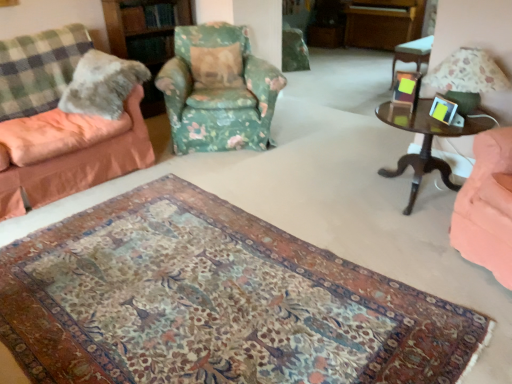
Question: Is metallic silver picture frame at upper right, which appears as the second picture frame when viewed from the front, spatially inside green checkered blanket at left, or outside of it?

Choices:
 (A) inside
 (B) outside

Answer: (B)

Question: Relative to green checkered blanket at left, is metallic silver picture frame at upper right, which appears as the second picture frame when viewed from the front, in front or behind?

Choices:
 (A) front
 (B) behind

Answer: (A)

Question: Which is farther from the dark wood side table at right, which is the first table in left-to-right order?

Choices:
 (A) fluffy fabric couch at left, which ranks as the second chair in right-to-left order
 (B) metallic silver picture frame at upper right, which appears as the second picture frame when viewed from the front
 (C) floral carpet at center
 (D) fluffy fabric pillow at center, marked as the 2th pillow in a front-to-back arrangement
 (E) floral fabric armchair at center, marked as the 2th chair in a left-to-right arrangement

Answer: (A)

Question: Which is farther from the fluffy fabric couch at left, which ranks as the second chair in right-to-left order?

Choices:
 (A) floral carpet at center
 (B) fuzzy fabric pillow at left, the second pillow from the back
 (C) metallic silver picture frame at right, which ranks as the second picture frame in back-to-front order
 (D) metallic silver picture frame at upper right, which appears as the second picture frame when viewed from the front
 (E) fluffy fabric pillow at center, which is the second pillow from left to right

Answer: (C)